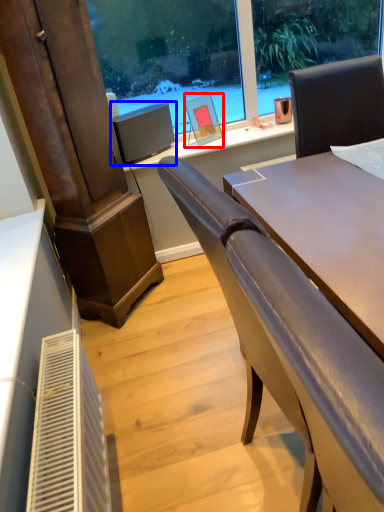
Question: Which object appears closest to the camera in this image, picture frame (highlighted by a red box) or computer monitor (highlighted by a blue box)?

Choices:
 (A) picture frame
 (B) computer monitor

Answer: (B)